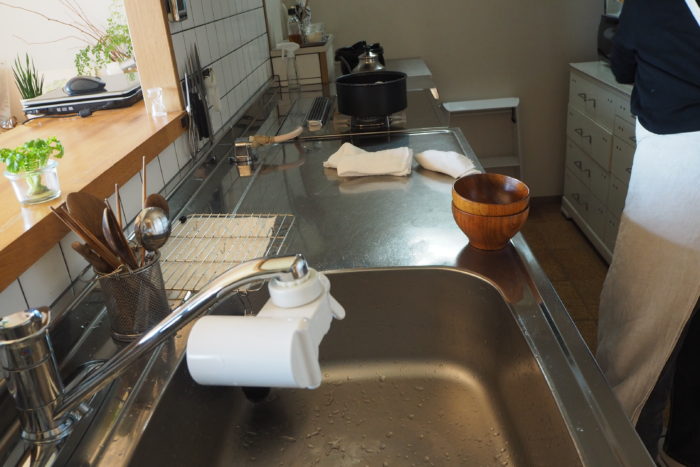
Where is `cabinet drawers`? cabinet drawers is located at coordinates (582, 100), (582, 130), (580, 168), (568, 203).